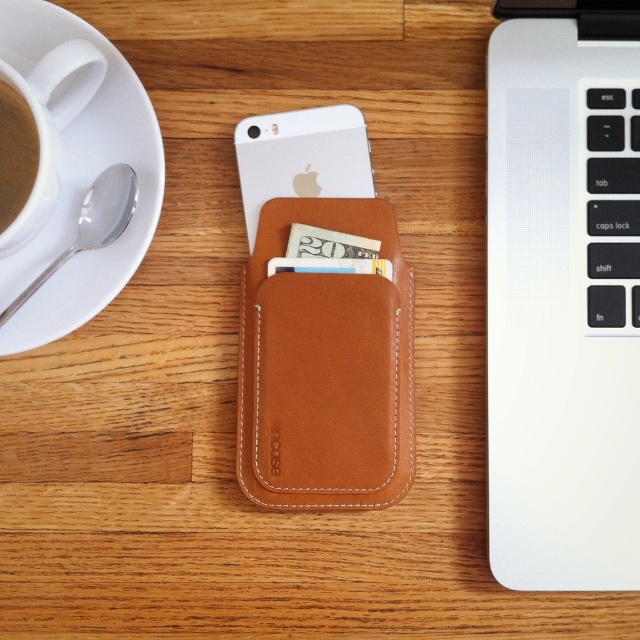
You are organizing your desk and want to place the white matte iphone at center and the brown matte cup of coffee at left. According to the image, which object is placed higher up?

The white matte iphone at center is positioned over the brown matte cup of coffee at left, so it is placed higher up.

You are organizing items on a desk and need to place a small notebook between the white ceramic saucer at upper left and the brown matte cup of coffee at left. Based on their positions, which object should the notebook be placed closer to in order to fit between them?

The white ceramic saucer at upper left is closer to the viewer than the brown matte cup of coffee at left. To place the notebook between them, it should be positioned closer to the white ceramic saucer at upper left since it is nearer in the line of sight.